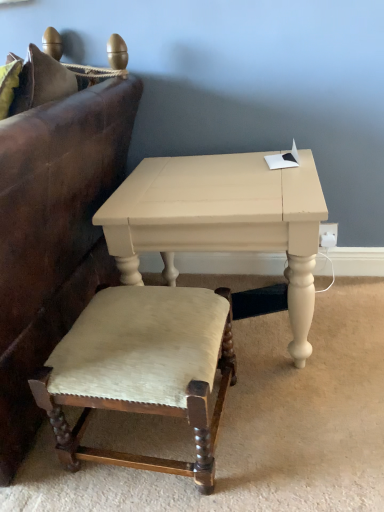
Question: Does leather couch at left have a greater width compared to matte white table at center?

Choices:
 (A) no
 (B) yes

Answer: (B)

Question: Is leather couch at left to the right of matte white table at center from the viewer's perspective?

Choices:
 (A) no
 (B) yes

Answer: (A)

Question: From a real-world perspective, is leather couch at left located higher than matte white table at center?

Choices:
 (A) no
 (B) yes

Answer: (B)

Question: Is matte white table at center located within leather couch at left?

Choices:
 (A) no
 (B) yes

Answer: (A)

Question: Is there a large distance between leather couch at left and matte white table at center?

Choices:
 (A) yes
 (B) no

Answer: (B)

Question: In terms of height, does velvet upholstered stool at lower left look taller or shorter compared to matte white table at center?

Choices:
 (A) tall
 (B) short

Answer: (B)

Question: From the image's perspective, is velvet upholstered stool at lower left above or below matte white table at center?

Choices:
 (A) below
 (B) above

Answer: (A)

Question: In terms of size, does velvet upholstered stool at lower left appear bigger or smaller than matte white table at center?

Choices:
 (A) big
 (B) small

Answer: (B)

Question: Is point click(x=125, y=377) closer or farther from the camera than point click(x=213, y=176)?

Choices:
 (A) closer
 (B) farther

Answer: (A)

Question: Which is correct: velvet upholstered stool at lower left is inside leather couch at left, or outside of it?

Choices:
 (A) inside
 (B) outside

Answer: (B)

Question: Is velvet upholstered stool at lower left bigger or smaller than leather couch at left?

Choices:
 (A) big
 (B) small

Answer: (B)

Question: From the image's perspective, relative to leather couch at left, is velvet upholstered stool at lower left above or below?

Choices:
 (A) below
 (B) above

Answer: (A)

Question: Is velvet upholstered stool at lower left taller or shorter than leather couch at left?

Choices:
 (A) tall
 (B) short

Answer: (B)

Question: In the image, is matte white table at center positioned in front of or behind velvet upholstered stool at lower left?

Choices:
 (A) front
 (B) behind

Answer: (B)

Question: From the image's perspective, relative to velvet upholstered stool at lower left, is matte white table at center above or below?

Choices:
 (A) below
 (B) above

Answer: (B)